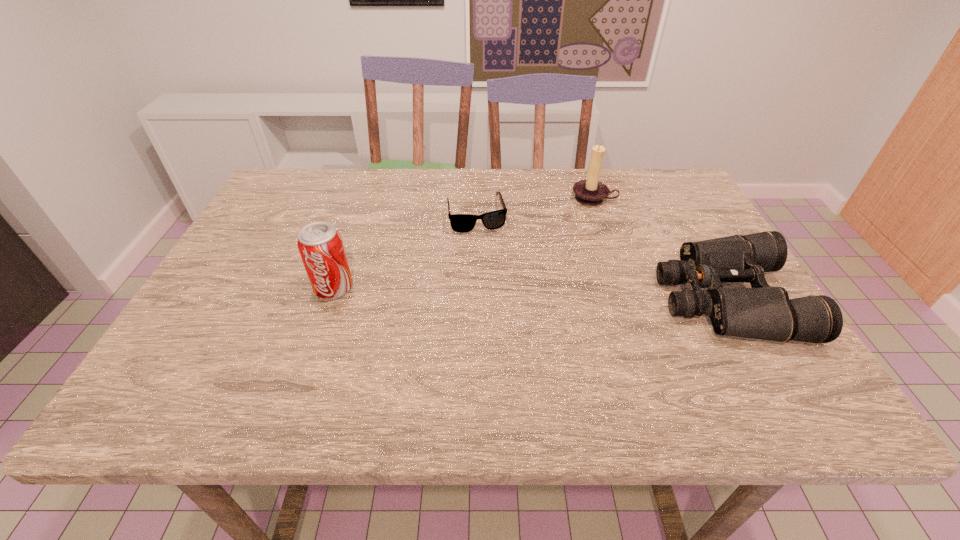
The image size is (960, 540). I want to click on vacant space on the desktop that is between the soda can and the binoculars and is positioned on the wick of the candle holder, so click(x=559, y=294).

Identify the location of free spot on the desktop that is between the leftmost object and the rightmost object and is positioned on the front-facing side of the shortest object. The image size is (960, 540). (499, 293).